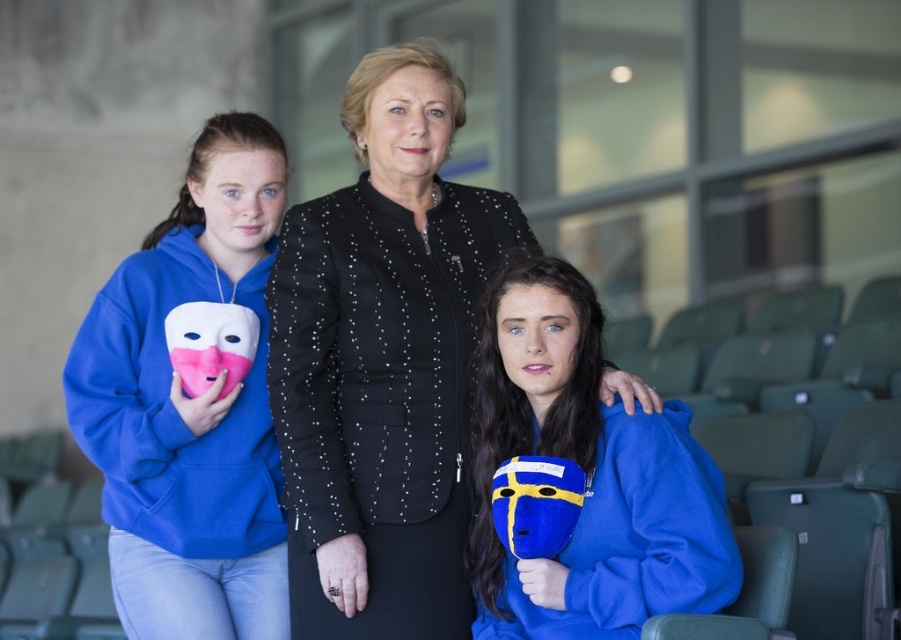
Is blue fleece mask at left bigger than blue matte mask at center?

Yes, blue fleece mask at left is bigger than blue matte mask at center.

Which is more to the left, blue fleece mask at left or blue matte mask at center?

Positioned to the left is blue fleece mask at left.

This screenshot has width=901, height=640. What are the coordinates of `blue fleece mask at left` in the screenshot? It's located at (189, 406).

Can you confirm if smooth black face at center is smaller than matte blue mask at left?

Correct, smooth black face at center occupies less space than matte blue mask at left.

Which is behind, point (432, 120) or point (226, 205)?

The point (226, 205) is behind.

This screenshot has height=640, width=901. Identify the location of smooth black face at center. (407, 125).

Does black textured jacket at center have a lesser width compared to blue matte mask at center?

No, black textured jacket at center is not thinner than blue matte mask at center.

What do you see at coordinates (381, 385) in the screenshot? Image resolution: width=901 pixels, height=640 pixels. I see `black textured jacket at center` at bounding box center [381, 385].

Where is `black textured jacket at center`? The height and width of the screenshot is (640, 901). black textured jacket at center is located at coordinates (381, 385).